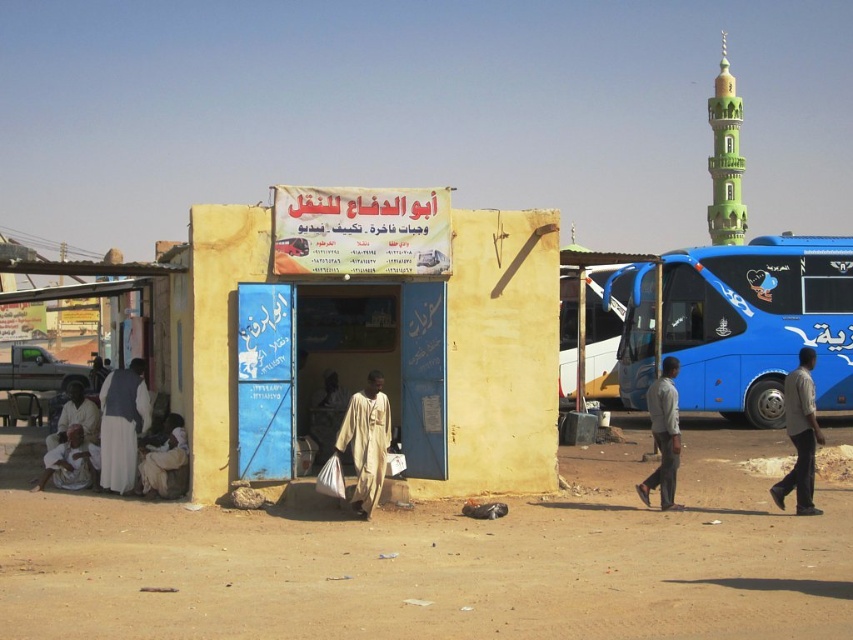
Question: Which point is closer to the camera taking this photo?

Choices:
 (A) (660, 452)
 (B) (357, 401)

Answer: (B)

Question: Can you confirm if yellow painted wall at center is smaller than white cloth at lower left?

Choices:
 (A) no
 (B) yes

Answer: (B)

Question: Estimate the real-world distances between objects in this image. Which object is closer to the light gray fabric shirt at lower right?

Choices:
 (A) white cloth at lower left
 (B) white cotton clothing at lower left
 (C) beige cotton robe at center

Answer: (C)

Question: Is yellow painted wall at center positioned before beige cotton robe at center?

Choices:
 (A) no
 (B) yes

Answer: (A)

Question: Where is yellow painted wall at center located in relation to blue metallic bus at right in the image?

Choices:
 (A) below
 (B) above

Answer: (A)

Question: Which object is the closest to the light gray fabric shirt at lower right?

Choices:
 (A) white cotton clothing at lower left
 (B) white cloth at lower left
 (C) yellow painted wall at center
 (D) blue metallic bus at right

Answer: (C)